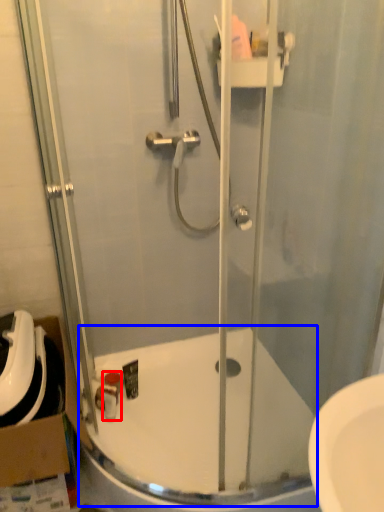
Question: Which of the following is the closest to the observer, toiletry (highlighted by a red box) or bath (highlighted by a blue box)?

Choices:
 (A) toiletry
 (B) bath

Answer: (B)